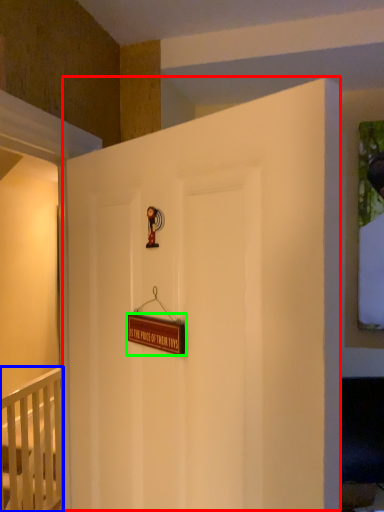
Question: Which object is the closest to the door (highlighted by a red box)? Choose among these: infant bed (highlighted by a blue box) or plaque (highlighted by a green box).

Choices:
 (A) infant bed
 (B) plaque

Answer: (B)